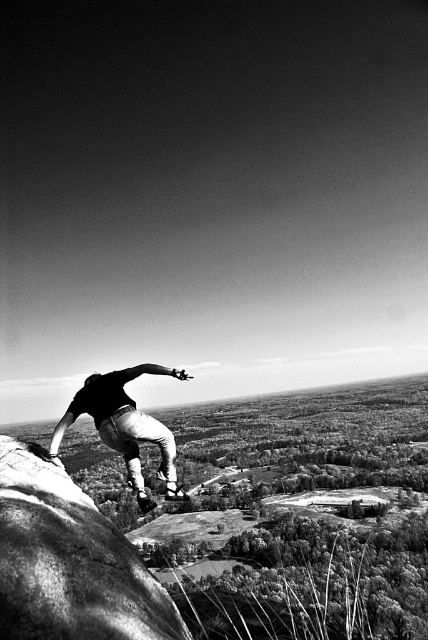
Question: Can you confirm if smooth black skateboard at center is smaller than metallic silver skateboard at lower center?

Choices:
 (A) yes
 (B) no

Answer: (A)

Question: Can you confirm if smooth black skateboard at center is positioned above metallic silver skateboard at lower center?

Choices:
 (A) no
 (B) yes

Answer: (B)

Question: Does smooth black skateboard at center appear on the right side of metallic silver skateboard at lower center?

Choices:
 (A) yes
 (B) no

Answer: (A)

Question: Among these points, which one is farthest from the camera?

Choices:
 (A) (88, 380)
 (B) (139, 492)

Answer: (B)